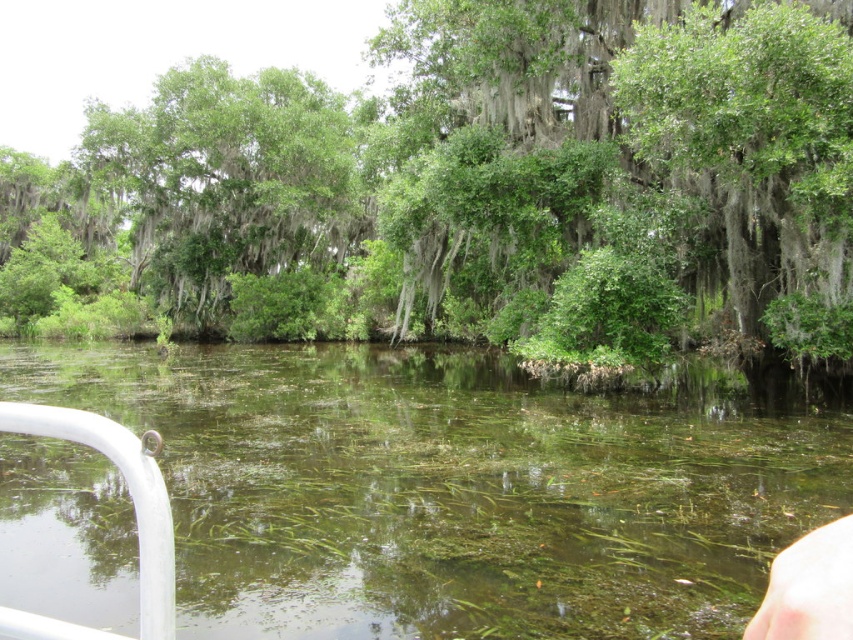
Who is higher up, white metallic rail at lower left or skinny white hand at lower right?

Positioned higher is skinny white hand at lower right.

What do you see at coordinates (128, 493) in the screenshot? The width and height of the screenshot is (853, 640). I see `white metallic rail at lower left` at bounding box center [128, 493].

This screenshot has height=640, width=853. What do you see at coordinates (128, 493) in the screenshot?
I see `white metallic rail at lower left` at bounding box center [128, 493].

Find the location of a particular element. This screenshot has height=640, width=853. white metallic rail at lower left is located at coordinates click(x=128, y=493).

You are a GUI agent. You are given a task and a screenshot of the screen. Output one action in this format:
    pyautogui.click(x=<x>, y=<y>)
    Task: Click on the green leafy tree at center
    
    Given the screenshot: What is the action you would take?
    pyautogui.click(x=471, y=189)

Between point (213, 330) and point (283, 410), which one is positioned in front?

Positioned in front is point (283, 410).

This screenshot has width=853, height=640. I want to click on green leafy tree at center, so click(x=471, y=189).

You are a GUI agent. You are given a task and a screenshot of the screen. Output one action in this format:
    pyautogui.click(x=<x>, y=<y>)
    Task: Click on the green leafy tree at center
    
    Given the screenshot: What is the action you would take?
    tap(471, 189)

Which is below, green leafy tree at center or white metallic rail at lower left?

white metallic rail at lower left

Where is `green leafy tree at center`? The height and width of the screenshot is (640, 853). green leafy tree at center is located at coordinates (471, 189).

At what (x,y) coordinates should I click in order to perform the action: click on green leafy tree at center. Please return your answer as a coordinate pair (x, y). This screenshot has width=853, height=640. Looking at the image, I should click on (471, 189).